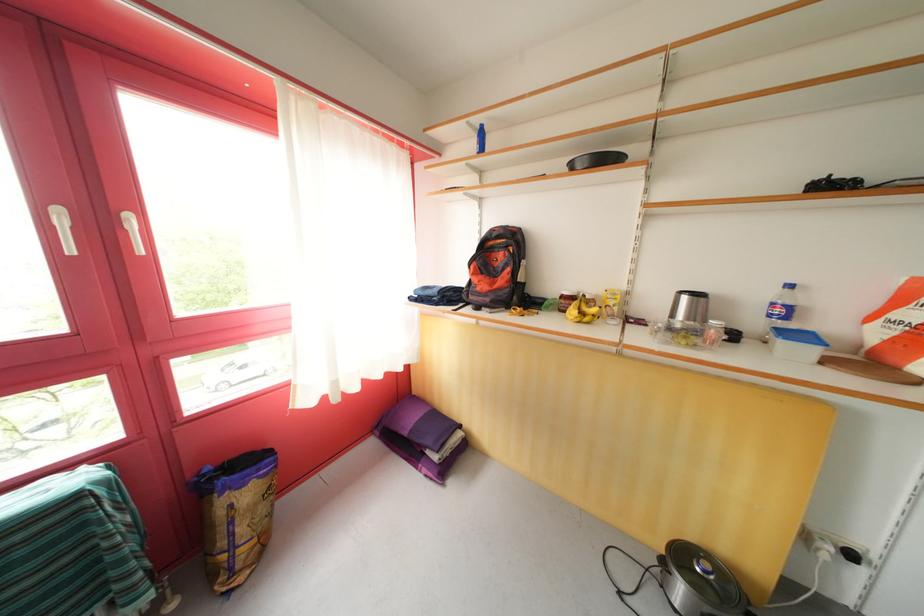
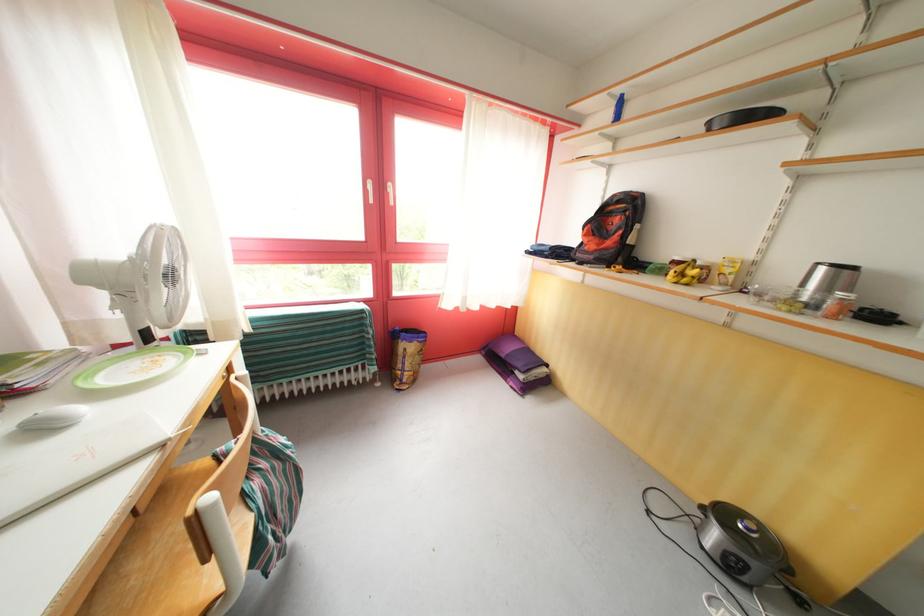
The point at [479,126] is marked in the first image. Where is the corresponding point in the second image?

(621, 95)